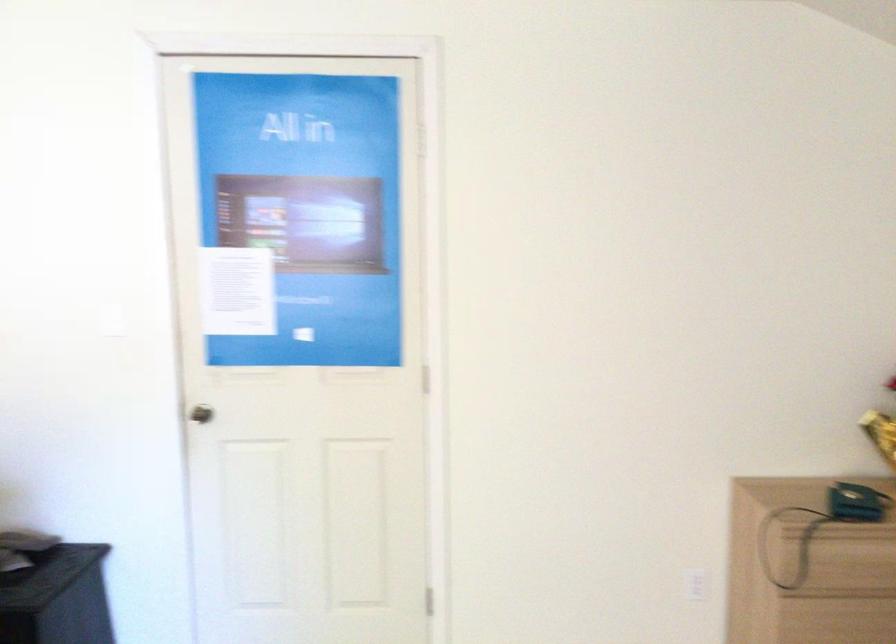
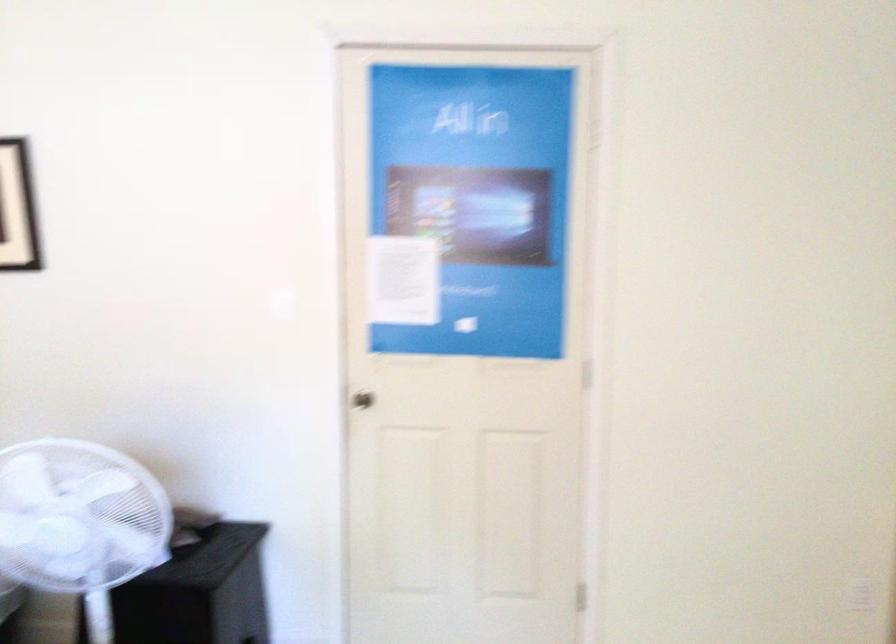
Question: The images are taken continuously from a first-person perspective. In which direction is your viewpoint rotating?

Choices:
 (A) Left
 (B) Right
 (C) Up
 (D) Down

Answer: (A)